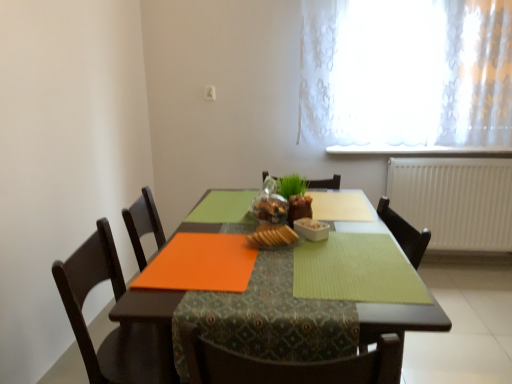
Find the location of a particular element. free spot above orange matte placemat at center (from a real-world perspective) is located at coordinates [x=284, y=247].